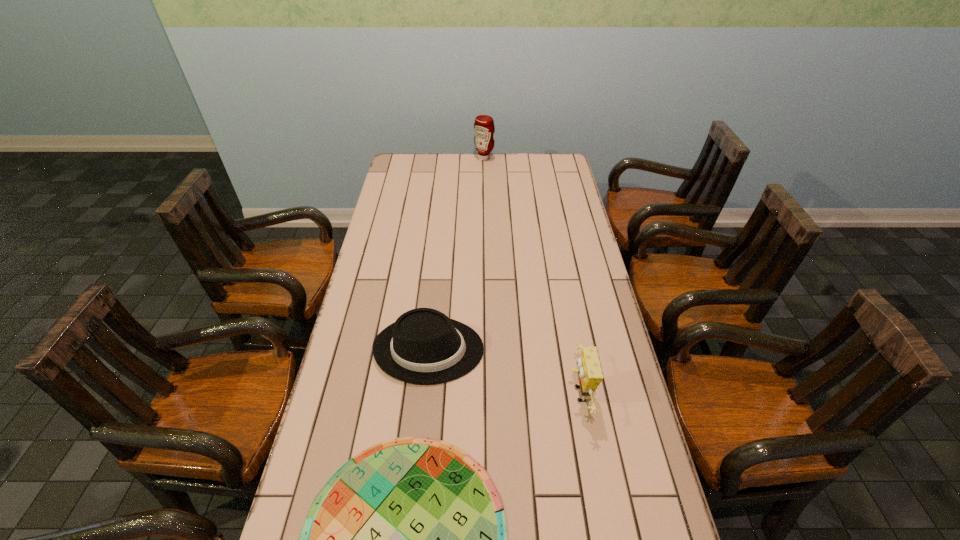
You are a GUI agent. You are given a task and a screenshot of the screen. Output one action in this format:
    pyautogui.click(x=<x>, y=<y>)
    Task: Click on the condiment
    
    Given the screenshot: What is the action you would take?
    pyautogui.click(x=484, y=127)

Where is `the farthest object`? The height and width of the screenshot is (540, 960). the farthest object is located at coordinates (484, 127).

In order to click on the third shortest object in this screenshot , I will do `click(589, 370)`.

You are a GUI agent. You are given a task and a screenshot of the screen. Output one action in this format:
    pyautogui.click(x=<x>, y=<y>)
    Task: Click on the rightmost object
    This screenshot has height=540, width=960.
    Given the screenshot: What is the action you would take?
    pyautogui.click(x=589, y=370)

Where is `fedora`? This screenshot has height=540, width=960. fedora is located at coordinates (423, 346).

Find the location of a particular element. This screenshot has height=540, width=960. vacant position located 0.160m on the right of the farthest object is located at coordinates (526, 158).

Find the location of a particular element. The width and height of the screenshot is (960, 540). blank area located on the face of the rightmost object is located at coordinates (434, 395).

What are the coordinates of `blank space located on the face of the rightmost object` in the screenshot? It's located at (434, 395).

The image size is (960, 540). What are the coordinates of `vacant region located 0.100m on the face of the rightmost object` in the screenshot? It's located at (530, 395).

Find the location of `free spot located 0.330m on the front-facing side of the third tallest object`. free spot located 0.330m on the front-facing side of the third tallest object is located at coordinates (592, 349).